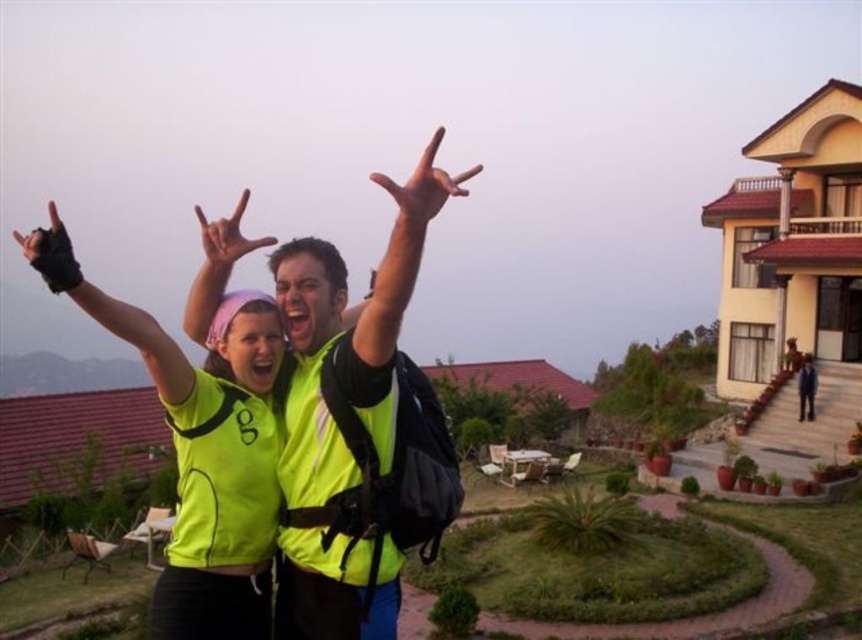
Question: Which object appears farthest from the camera in this image?

Choices:
 (A) green matte hand at center
 (B) matte yellow vest at upper center
 (C) neon yellow glove at upper center

Answer: (A)

Question: Is neon yellow reflective vest at center above blue fabric jacket at center?

Choices:
 (A) yes
 (B) no

Answer: (A)

Question: Can you confirm if neon yellow reflective vest at center is positioned below blue fabric jacket at center?

Choices:
 (A) yes
 (B) no

Answer: (B)

Question: Which object is positioned farthest from the neon yellow fabric at upper center?

Choices:
 (A) neon yellow glove at upper center
 (B) neon yellow reflective vest at center
 (C) blue fabric jacket at center

Answer: (C)

Question: Which is farther from the green matte vest at upper center?

Choices:
 (A) black leather glove at upper left
 (B) blue fabric jacket at center

Answer: (A)

Question: In this image, where is neon yellow glove at upper center located relative to blue fabric jacket at center?

Choices:
 (A) left
 (B) right

Answer: (A)